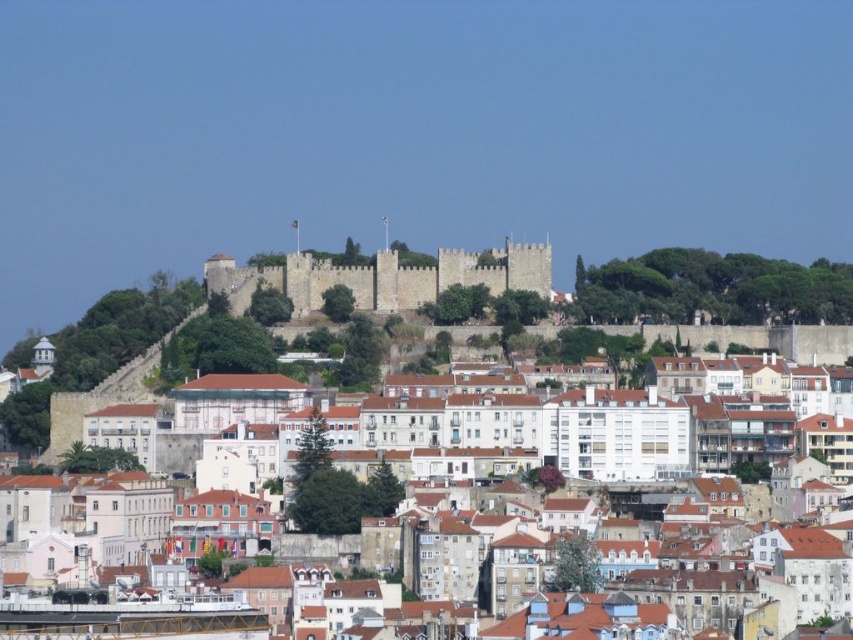
Is white stone buildings at center above gray stone castle at center?

Incorrect, white stone buildings at center is not positioned above gray stone castle at center.

What are the coordinates of `white stone buildings at center` in the screenshot? It's located at (570, 428).